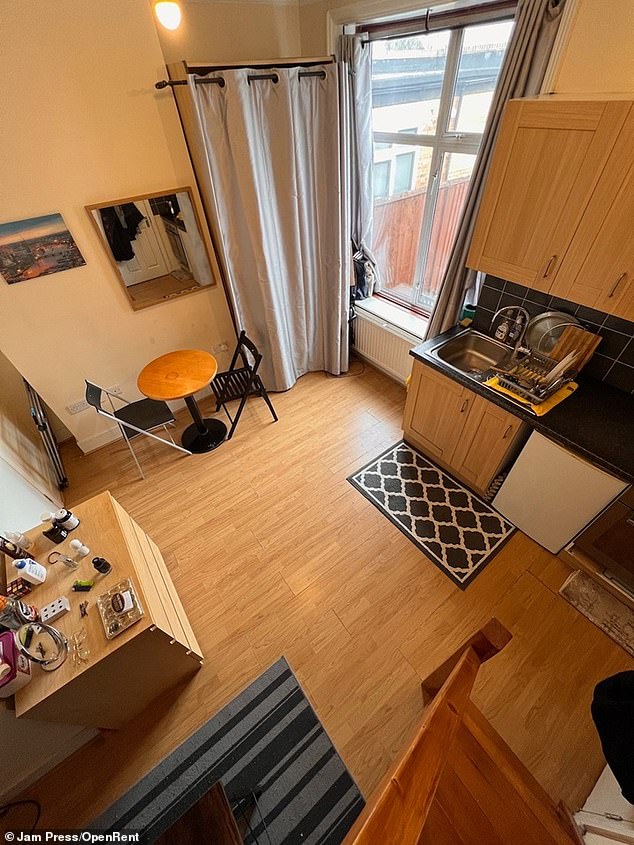
You are a GUI agent. You are given a task and a screenshot of the screen. Output one action in this format:
    pyautogui.click(x=<x>, y=<y>)
    Task: Click on the dishwasher
    The width and height of the screenshot is (634, 845).
    Given the screenshot: What is the action you would take?
    pyautogui.click(x=566, y=494)